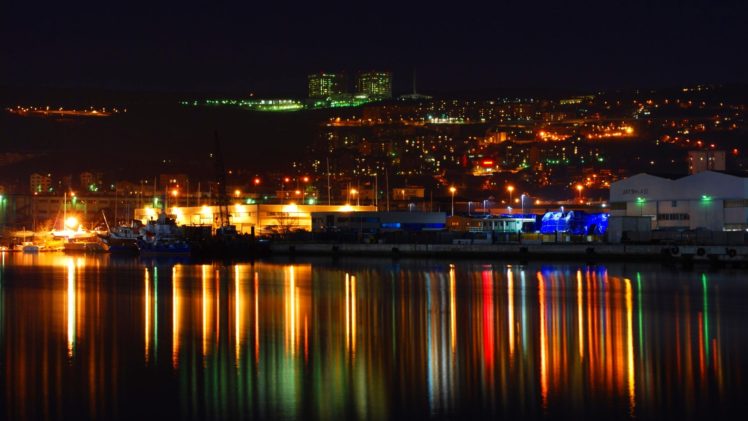
Where is `green light`? The width and height of the screenshot is (748, 421). green light is located at coordinates (689, 200).